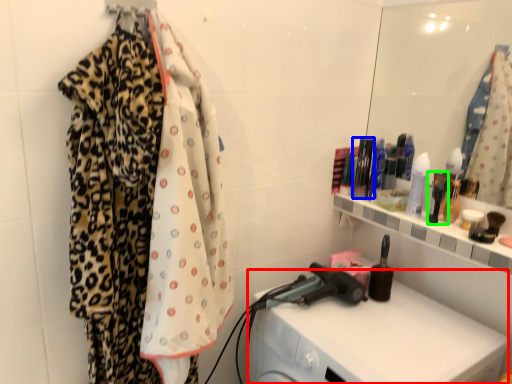
Question: Estimate the real-world distances between objects in this image. Which object is farther from washing machine (highlighted by a red box), toiletry (highlighted by a blue box) or toiletry (highlighted by a green box)?

Choices:
 (A) toiletry
 (B) toiletry

Answer: (A)